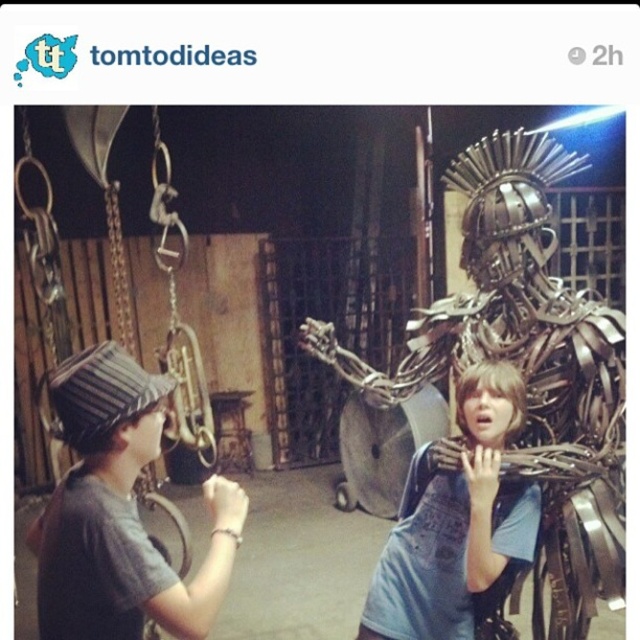
Question: Does striped fabric hat at left have a greater width compared to metallic wire sculpture at center?

Choices:
 (A) yes
 (B) no

Answer: (B)

Question: Which of the following is the farthest from the observer?

Choices:
 (A) metallic armor at right
 (B) metallic wire sculpture at center

Answer: (A)

Question: Among these objects, which one is farthest from the camera?

Choices:
 (A) metallic armor at right
 (B) metallic wire sculpture at center

Answer: (A)

Question: Is metallic armor at right above metallic wire sculpture at center?

Choices:
 (A) no
 (B) yes

Answer: (B)

Question: Can you confirm if metallic armor at right is positioned above metallic wire sculpture at center?

Choices:
 (A) yes
 (B) no

Answer: (A)

Question: Among these points, which one is nearest to the camera?

Choices:
 (A) (445, 566)
 (B) (588, 456)

Answer: (A)